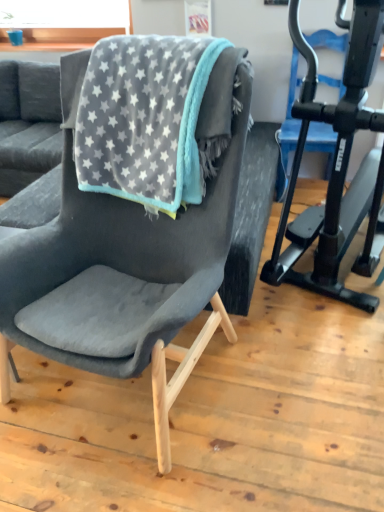
Where is `velvet grey blanket with star pattern at center`? This screenshot has height=512, width=384. velvet grey blanket with star pattern at center is located at coordinates (144, 119).

Describe the element at coordinates (336, 165) in the screenshot. I see `black matte stationary bicycle at right` at that location.

Locate an element on the screen. velvet dark gray chair at center is located at coordinates (122, 270).

Find the location of a particular element. velvet grey blanket with star pattern at center is located at coordinates (144, 119).

Is black matte stationary bicycle at right positioned behind velvet grey blanket with star pattern at center?

No, it is in front of velvet grey blanket with star pattern at center.

Image resolution: width=384 pixels, height=512 pixels. Find the location of `stationary bicycle on the right of velvet grey blanket with star pattern at center`. stationary bicycle on the right of velvet grey blanket with star pattern at center is located at coordinates (336, 165).

Which of these two, black matte stationary bicycle at right or velvet grey blanket with star pattern at center, is bigger?

With larger size is black matte stationary bicycle at right.

Visually, is black matte stationary bicycle at right positioned to the left or to the right of velvet grey blanket with star pattern at center?

Based on their positions, black matte stationary bicycle at right is located to the right of velvet grey blanket with star pattern at center.

Does velvet dark gray chair at center turn towards velvet grey blanket with star pattern at center?

No, velvet dark gray chair at center is not turned towards velvet grey blanket with star pattern at center.

From the image's perspective, is velvet dark gray chair at center beneath velvet grey blanket with star pattern at center?

Yes.

Which of these two, velvet dark gray chair at center or velvet grey blanket with star pattern at center, is wider?

velvet dark gray chair at center is wider.

From a real-world perspective, which object stands above the other?

In real-world perspective, velvet grey blanket with star pattern at center is above.

Is velvet grey blanket with star pattern at center shorter than velvet dark gray chair at center?

Yes, velvet grey blanket with star pattern at center is shorter than velvet dark gray chair at center.

Is velvet grey blanket with star pattern at center touching velvet dark gray chair at center?

They are not placed beside each other.

Is velvet grey blanket with star pattern at center looking in the opposite direction of velvet dark gray chair at center?

Absolutely, velvet grey blanket with star pattern at center is directed away from velvet dark gray chair at center.

Can we say velvet grey blanket with star pattern at center lies outside black matte stationary bicycle at right?

Absolutely, velvet grey blanket with star pattern at center is external to black matte stationary bicycle at right.

Is velvet grey blanket with star pattern at center positioned with its back to black matte stationary bicycle at right?

That's not correct — velvet grey blanket with star pattern at center is not looking away from black matte stationary bicycle at right.

Consider the image. Can you confirm if velvet grey blanket with star pattern at center is smaller than black matte stationary bicycle at right?

Indeed, velvet grey blanket with star pattern at center has a smaller size compared to black matte stationary bicycle at right.

Is velvet grey blanket with star pattern at center far away from black matte stationary bicycle at right?

Actually, velvet grey blanket with star pattern at center and black matte stationary bicycle at right are a little close together.

Who is taller, velvet dark gray chair at center or black matte stationary bicycle at right?

Standing taller between the two is black matte stationary bicycle at right.

What's the angular difference between velvet dark gray chair at center and black matte stationary bicycle at right's facing directions?

13.5 degrees.

Does velvet dark gray chair at center have a greater width compared to black matte stationary bicycle at right?

No.

Is velvet dark gray chair at center at the left side of black matte stationary bicycle at right?

Yes.

Can you tell me how much black matte stationary bicycle at right and velvet dark gray chair at center differ in facing direction?

The facing directions of black matte stationary bicycle at right and velvet dark gray chair at center are 13.5 degrees apart.

Would you consider black matte stationary bicycle at right to be distant from velvet dark gray chair at center?

No, black matte stationary bicycle at right is not far away from velvet dark gray chair at center.

Locate an element on the screen. stationary bicycle located above the velvet dark gray chair at center (from a real-world perspective) is located at coordinates (336, 165).

Where is `beach towel behind the black matte stationary bicycle at right`? This screenshot has width=384, height=512. beach towel behind the black matte stationary bicycle at right is located at coordinates (144, 119).

Find the location of a particular element. chair below the velvet grey blanket with star pattern at center (from the image's perspective) is located at coordinates (122, 270).

When comparing their distances from velvet dark gray chair at center, does black matte stationary bicycle at right or velvet grey blanket with star pattern at center seem further?

Among the two, black matte stationary bicycle at right is located further to velvet dark gray chair at center.

When comparing their distances from velvet grey blanket with star pattern at center, does velvet dark gray chair at center or black matte stationary bicycle at right seem further?

black matte stationary bicycle at right lies further to velvet grey blanket with star pattern at center than the other object.

Estimate the real-world distances between objects in this image. Which object is further from velvet dark gray chair at center, velvet grey blanket with star pattern at center or black matte stationary bicycle at right?

black matte stationary bicycle at right is positioned further to the anchor velvet dark gray chair at center.

Considering their positions, is black matte stationary bicycle at right positioned closer to velvet grey blanket with star pattern at center than velvet dark gray chair at center?

velvet dark gray chair at center lies closer to velvet grey blanket with star pattern at center than the other object.

Estimate the real-world distances between objects in this image. Which object is closer to black matte stationary bicycle at right, velvet grey blanket with star pattern at center or velvet dark gray chair at center?

The object closer to black matte stationary bicycle at right is velvet grey blanket with star pattern at center.

Based on their spatial positions, is velvet dark gray chair at center or velvet grey blanket with star pattern at center further from black matte stationary bicycle at right?

The object further to black matte stationary bicycle at right is velvet dark gray chair at center.

Identify the location of beach towel between velvet dark gray chair at center and black matte stationary bicycle at right. The image size is (384, 512). (144, 119).